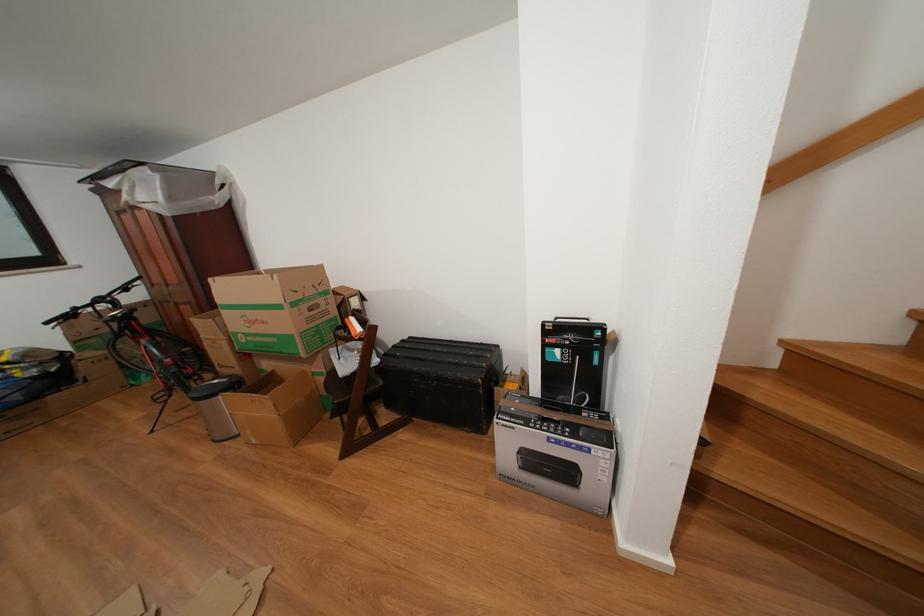
Describe the element at coordinates (450, 353) in the screenshot. The height and width of the screenshot is (616, 924). I see `a black trunk lid` at that location.